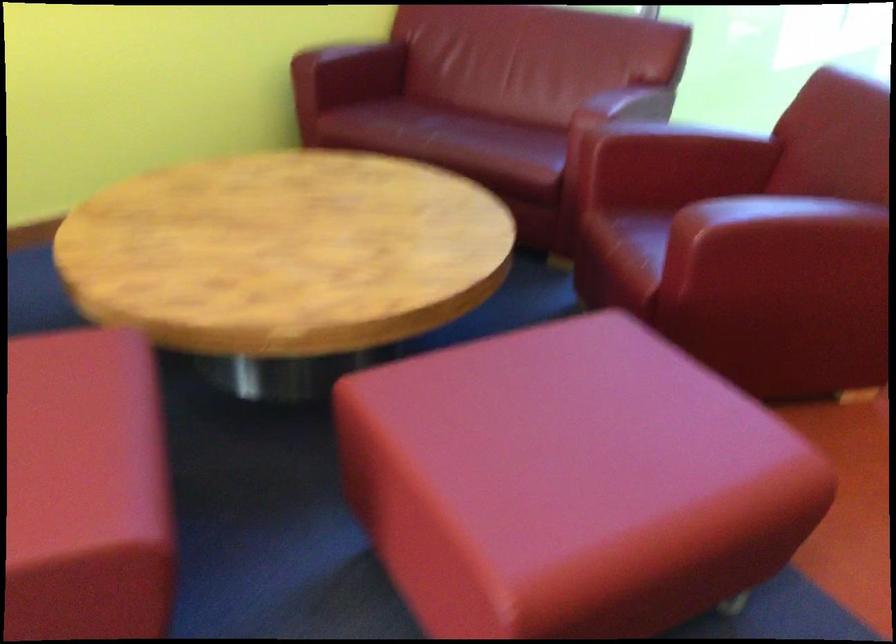
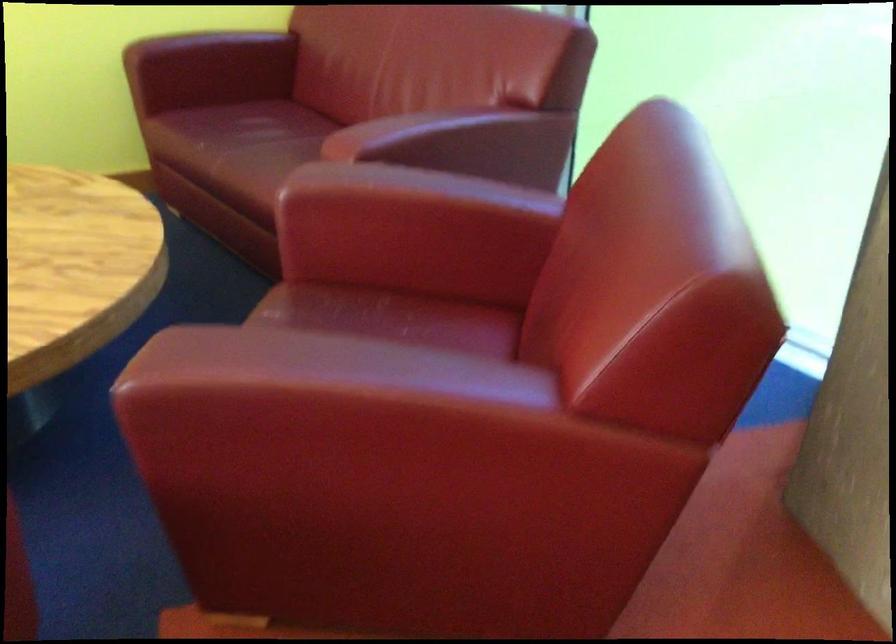
In the second image, find the point that corresponds to (721,236) in the first image.

(177, 386)